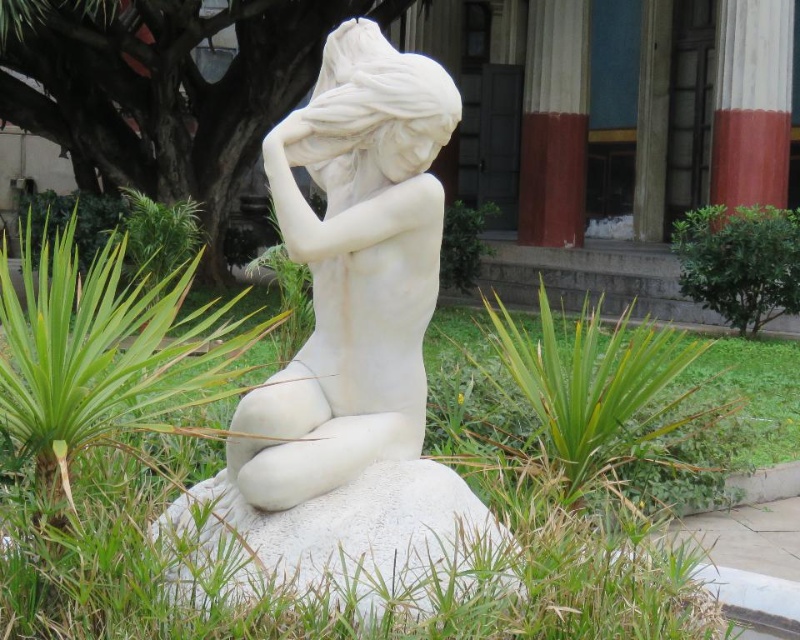
You are a landscape architect designing a garden pathway that needs to pass between the white marble statue at center and the green leafy plant at center. The pathway must be at least 1 meter wide. Can you determine if there is enough space between them based on their widths?

The white marble statue at center might be wider than green leafy plant at center, so it is uncertain whether there is enough space for a 1 meter wide pathway between them without more specific measurements.

You are an art student planning to sketch the white marble statue at center and the green leafy plant at center in the garden. Which object should you focus on first if you want to draw the larger one?

The white marble statue at center is larger in size than the green leafy plant at center, so you should focus on drawing the white marble statue at center first.